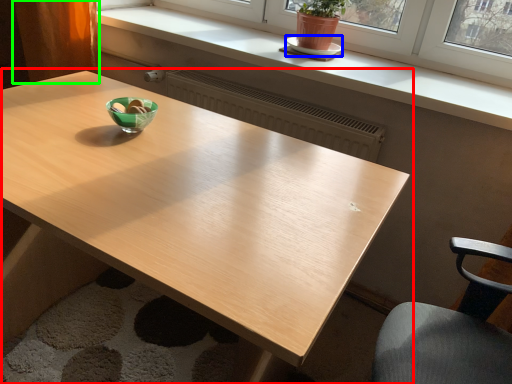
Question: Considering the real-world distances, which object is farthest from table (highlighted by a red box)? saucer (highlighted by a blue box) or curtain (highlighted by a green box)?

Choices:
 (A) saucer
 (B) curtain

Answer: (A)